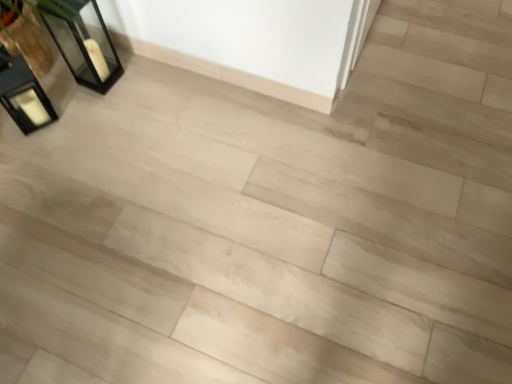
At what (x,y) coordinates should I click in order to perform the action: click on free space in front of matte black lantern at left. Please return your answer as a coordinate pair (x, y). Looking at the image, I should click on (37, 155).